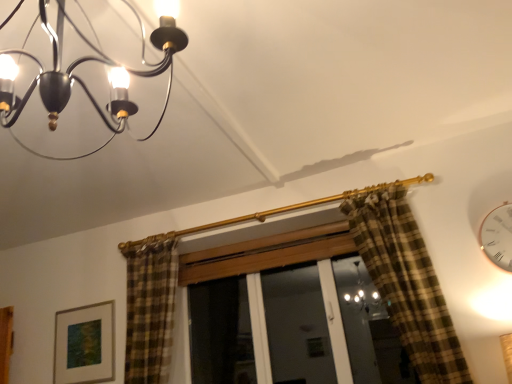
Question: Is matte black chandelier at upper left positioned with its back to matte gold picture frame at lower left?

Choices:
 (A) yes
 (B) no

Answer: (B)

Question: Does matte black chandelier at upper left have a lesser height compared to matte gold picture frame at lower left?

Choices:
 (A) no
 (B) yes

Answer: (A)

Question: Does matte black chandelier at upper left have a greater height compared to matte gold picture frame at lower left?

Choices:
 (A) yes
 (B) no

Answer: (A)

Question: Can you confirm if matte black chandelier at upper left is positioned to the right of matte gold picture frame at lower left?

Choices:
 (A) yes
 (B) no

Answer: (A)

Question: Does matte black chandelier at upper left have a lesser width compared to matte gold picture frame at lower left?

Choices:
 (A) no
 (B) yes

Answer: (A)

Question: Is white glossy clock at upper right wider or thinner than matte gold picture frame at lower left?

Choices:
 (A) thin
 (B) wide

Answer: (B)

Question: Considering the positions of white glossy clock at upper right and matte gold picture frame at lower left in the image, is white glossy clock at upper right bigger or smaller than matte gold picture frame at lower left?

Choices:
 (A) big
 (B) small

Answer: (B)

Question: Does point (502, 221) appear closer or farther from the camera than point (111, 317)?

Choices:
 (A) closer
 (B) farther

Answer: (A)

Question: Would you say white glossy clock at upper right is inside or outside matte gold picture frame at lower left?

Choices:
 (A) inside
 (B) outside

Answer: (B)

Question: From the image's perspective, relative to matte black chandelier at upper left, is matte gold picture frame at lower left above or below?

Choices:
 (A) above
 (B) below

Answer: (B)

Question: From their relative heights in the image, would you say matte gold picture frame at lower left is taller or shorter than matte black chandelier at upper left?

Choices:
 (A) short
 (B) tall

Answer: (A)

Question: From a real-world perspective, is matte gold picture frame at lower left physically located above or below matte black chandelier at upper left?

Choices:
 (A) below
 (B) above

Answer: (A)

Question: Choose the correct answer: Is matte gold picture frame at lower left inside matte black chandelier at upper left or outside it?

Choices:
 (A) inside
 (B) outside

Answer: (B)

Question: Does point (141, 56) appear closer or farther from the camera than point (482, 238)?

Choices:
 (A) farther
 (B) closer

Answer: (B)

Question: Considering their positions, is matte black chandelier at upper left located in front of or behind white glossy clock at upper right?

Choices:
 (A) front
 (B) behind

Answer: (A)